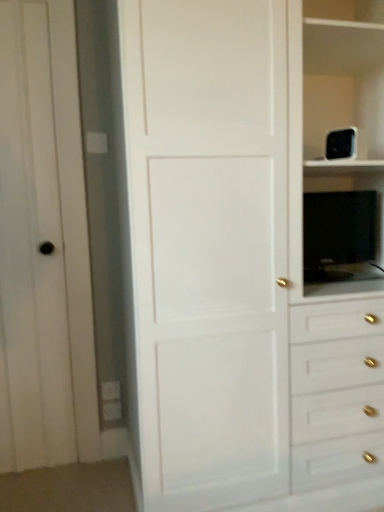
What is the approximate height of white matte door at center?

The height of white matte door at center is 2.09 meters.

The height and width of the screenshot is (512, 384). I want to click on black glossy tv at right, so tap(339, 234).

Are black glossy tv at right and white matte door at left located far from each other?

black glossy tv at right is far away from white matte door at left.

Which is in front, black glossy tv at right or white matte door at left?

white matte door at left is closer to the camera.

From the image's perspective, is black glossy tv at right located above or below white matte door at left?

From the image's perspective, black glossy tv at right appears above white matte door at left.

Could you tell me if black glossy tv at right is facing white matte door at left?

No, black glossy tv at right is not facing towards white matte door at left.

Considering the sizes of objects black glossy tv at right and white matte door at center in the image provided, who is wider, black glossy tv at right or white matte door at center?

white matte door at center is wider.

From a real-world perspective, is black glossy tv at right on white matte door at center?

No, from a real-world perspective, black glossy tv at right is not over white matte door at center

Does black glossy tv at right have a larger size compared to white matte door at center?

No.

Is point (343, 209) more distant than point (241, 79)?

Yes, it is behind point (241, 79).

From the picture: Who is bigger, white matte door at center or black glossy tv at right?

With larger size is white matte door at center.

Based on the photo, can we say white matte door at center lies outside black glossy tv at right?

white matte door at center lies outside black glossy tv at right's area.

This screenshot has height=512, width=384. I want to click on appliance behind the white matte door at center, so click(339, 234).

Is white matte door at center wider than black glossy tv at right?

Yes.

How different are the orientations of white matte door at left and white matte door at center in degrees?

white matte door at left and white matte door at center are facing 0.00327 degrees away from each other.

From the image's perspective, is white matte door at left located above or below white matte door at center?

white matte door at left is situated lower than white matte door at center in the image.

Between white matte door at left and white matte door at center, which one has smaller width?

white matte door at left.

Is the position of white matte door at left more distant than that of black glossy tv at right?

No, the depth of white matte door at left is less than that of black glossy tv at right.

Based on the photo, is white matte door at left positioned far away from black glossy tv at right?

Yes, white matte door at left and black glossy tv at right are quite far apart.

Considering the positions of objects white matte door at left and black glossy tv at right in the image provided, who is more to the right, white matte door at left or black glossy tv at right?

Positioned to the right is black glossy tv at right.

Is white matte door at left taller than black glossy tv at right?

Indeed, white matte door at left has a greater height compared to black glossy tv at right.

Could you tell me if white matte door at center is turned towards white matte door at left?

No, white matte door at center is not facing towards white matte door at left.

Does point (193, 415) come closer to viewer compared to point (29, 41)?

Yes, it is.

Is white matte door at center wider or thinner than white matte door at left?

white matte door at center is wider than white matte door at left.

Who is shorter, white matte door at center or white matte door at left?

Standing shorter between the two is white matte door at left.

Find the location of a particular element. The height and width of the screenshot is (512, 384). glass door below the black glossy tv at right (from the image's perspective) is located at coordinates (45, 239).

This screenshot has height=512, width=384. What are the coordinates of `door that appears on the left of black glossy tv at right` in the screenshot? It's located at (208, 246).

Looking at this image, which object lies further to the anchor point white matte door at left, white matte door at center or black glossy tv at right?

black glossy tv at right lies further to white matte door at left than the other object.

Looking at the image, which one is located further to white matte door at center, white matte door at left or black glossy tv at right?

Among the two, white matte door at left is located further to white matte door at center.

Estimate the real-world distances between objects in this image. Which object is closer to white matte door at center, black glossy tv at right or white matte door at left?

black glossy tv at right.

Looking at the image, which one is located closer to black glossy tv at right, white matte door at center or white matte door at left?

Based on the image, white matte door at center appears to be nearer to black glossy tv at right.

Looking at this image, based on their spatial positions, is black glossy tv at right or white matte door at center closer to white matte door at left?

white matte door at center.

Looking at the image, which one is located further to black glossy tv at right, white matte door at left or white matte door at center?

The object further to black glossy tv at right is white matte door at left.

You are a GUI agent. You are given a task and a screenshot of the screen. Output one action in this format:
    pyautogui.click(x=<x>, y=<y>)
    Task: Click on the door between white matte door at left and black glossy tv at right in the horizontal direction
    
    Given the screenshot: What is the action you would take?
    (208, 246)